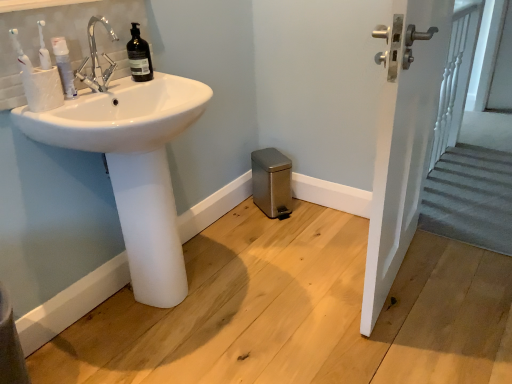
Question: Can you confirm if black matte bottle at upper left is smaller than white matte toothpaste tube at left?

Choices:
 (A) yes
 (B) no

Answer: (B)

Question: Can you confirm if black matte bottle at upper left is bigger than white matte toothpaste tube at left?

Choices:
 (A) yes
 (B) no

Answer: (A)

Question: From a real-world perspective, is black matte bottle at upper left under white matte toothpaste tube at left?

Choices:
 (A) no
 (B) yes

Answer: (A)

Question: Is black matte bottle at upper left aimed at white matte toothpaste tube at left?

Choices:
 (A) no
 (B) yes

Answer: (A)

Question: Is white matte toothpaste tube at left a part of black matte bottle at upper left?

Choices:
 (A) yes
 (B) no

Answer: (B)

Question: Is black matte bottle at upper left positioned before white matte toothpaste tube at left?

Choices:
 (A) yes
 (B) no

Answer: (B)

Question: Does white glossy door handle at upper right appear on the left side of black matte bottle at upper left?

Choices:
 (A) no
 (B) yes

Answer: (A)

Question: Is white glossy door handle at upper right located outside black matte bottle at upper left?

Choices:
 (A) no
 (B) yes

Answer: (B)

Question: Can you confirm if white glossy door handle at upper right is bigger than black matte bottle at upper left?

Choices:
 (A) no
 (B) yes

Answer: (B)

Question: Does white glossy door handle at upper right lie behind black matte bottle at upper left?

Choices:
 (A) no
 (B) yes

Answer: (A)

Question: From the image's perspective, is white glossy door handle at upper right located beneath black matte bottle at upper left?

Choices:
 (A) no
 (B) yes

Answer: (B)

Question: Does white glossy door handle at upper right have a lesser width compared to black matte bottle at upper left?

Choices:
 (A) yes
 (B) no

Answer: (B)

Question: Is white glossy sink at left oriented away from white textured cup at left?

Choices:
 (A) yes
 (B) no

Answer: (B)